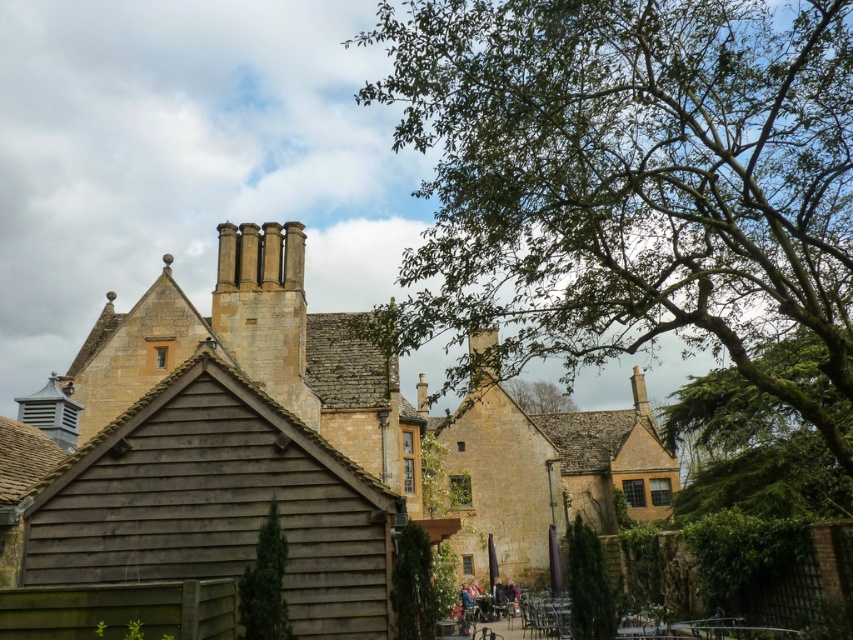
Question: Which point is farther to the camera?

Choices:
 (A) green leafy tree at center
 (B) green leafy tree at upper center
 (C) green textured tree at center

Answer: (A)

Question: Does green textured tree at center appear on the right side of green textured hedge at lower center?

Choices:
 (A) yes
 (B) no

Answer: (B)

Question: Is green leafy tree at upper center closer to camera compared to green textured hedge at lower center?

Choices:
 (A) no
 (B) yes

Answer: (B)

Question: Which object is positioned closest to the green textured tree at center?

Choices:
 (A) green textured hedge at lower center
 (B) green leafy tree at center
 (C) green leafy tree at upper center

Answer: (A)

Question: Which object appears farthest from the camera in this image?

Choices:
 (A) green textured hedge at lower center
 (B) green leafy tree at upper center

Answer: (A)

Question: Is green textured hedge at lower center smaller than green leafy tree at center?

Choices:
 (A) no
 (B) yes

Answer: (B)